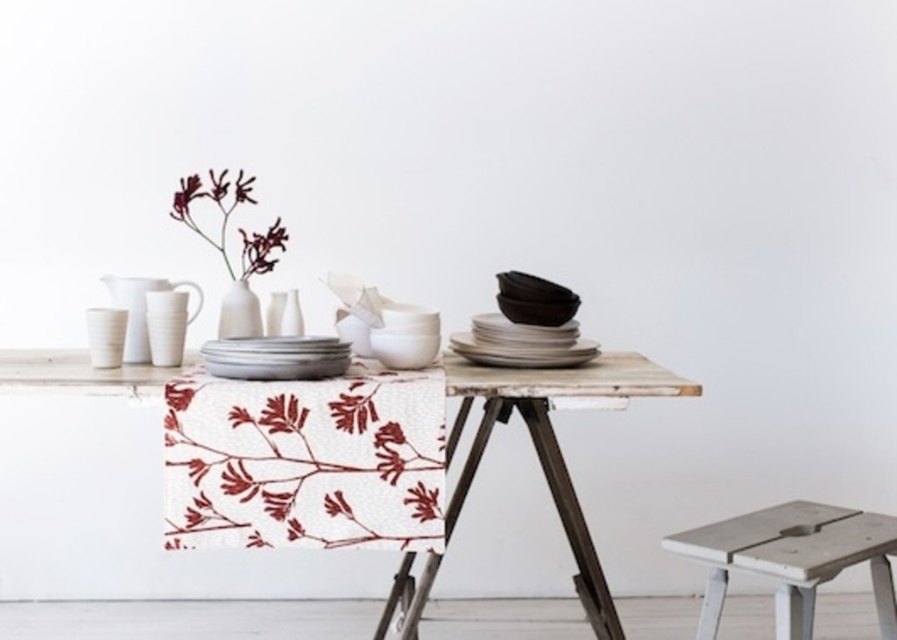
You are standing in front of a table with a white matte platter at center. If you want to grab the platter without moving your feet, can you reach it if your arm can extend 1.6 meters?

The white matte platter at center is 1.74 meters away from the viewer. Since your arm can only extend 1.6 meters, you cannot reach it without moving your feet.

You are setting up a table for a dinner party and need to place a centerpiece on the table. You have the white textured tablecloth at center and the white matte vase at center. Where should you place the vase to ensure it sits properly on the tablecloth?

The white textured tablecloth at center is located below the white matte vase at center, so you should place the white matte vase at center directly on top of the white textured tablecloth at center to ensure it sits properly.

You are arranging a dinner party and need to place a centerpiece on the table. You have a white matte platter at center and a white matte vase at center. According to the image, where should you position them to match the existing arrangement?

The white matte platter at center should be placed to the right of the white matte vase at center to match the existing arrangement.